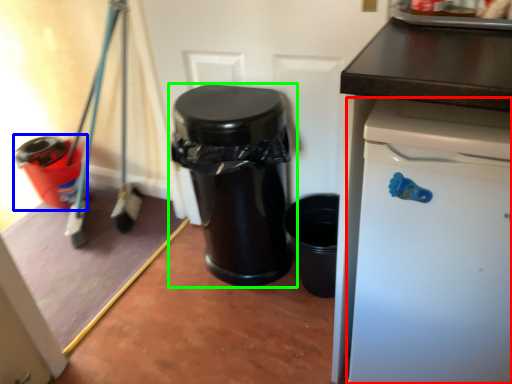
Question: Which object is the closest to the dish washer (highlighted by a red box)? Choose among these: waste container (highlighted by a blue box) or waste container (highlighted by a green box).

Choices:
 (A) waste container
 (B) waste container

Answer: (B)